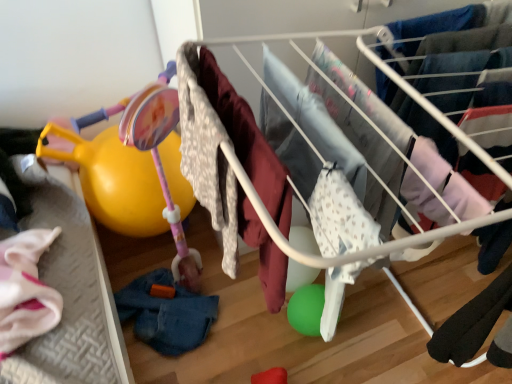
Question: From a real-world perspective, is matte pink plastic baby carriage at left positioned above or below fluffy white blanket at center, the 2th clothing in the left-to-right sequence?

Choices:
 (A) above
 (B) below

Answer: (B)

Question: From the image's perspective, is matte pink plastic baby carriage at left above or below fluffy white blanket at center, the second clothing when ordered from bottom to top?

Choices:
 (A) above
 (B) below

Answer: (A)

Question: Which of these objects is positioned closest to the fluffy white blanket at center, acting as the second clothing starting from the back?

Choices:
 (A) denim at lower left, which is the 2th clothing in top-to-bottom order
 (B) matte pink plastic baby carriage at left
 (C) white fabric baby clothes at center

Answer: (C)

Question: Based on their relative distances, which object is farther from the fluffy white blanket at center, the 1th clothing when ordered from right to left?

Choices:
 (A) matte pink plastic baby carriage at left
 (B) white fabric baby clothes at center
 (C) denim at lower left, the 1th clothing when ordered from back to front

Answer: (C)